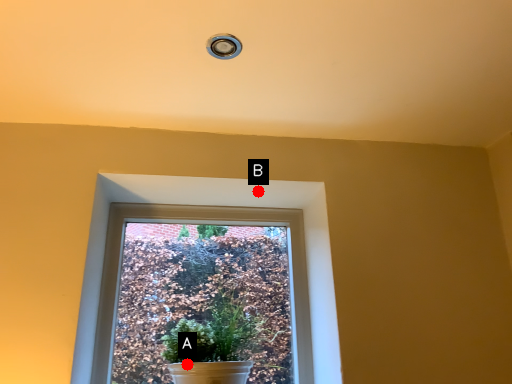
Question: Two points are circled on the image, labeled by A and B beside each circle. Which of the following is the closest to the observer?

Choices:
 (A) A is closer
 (B) B is closer

Answer: (A)